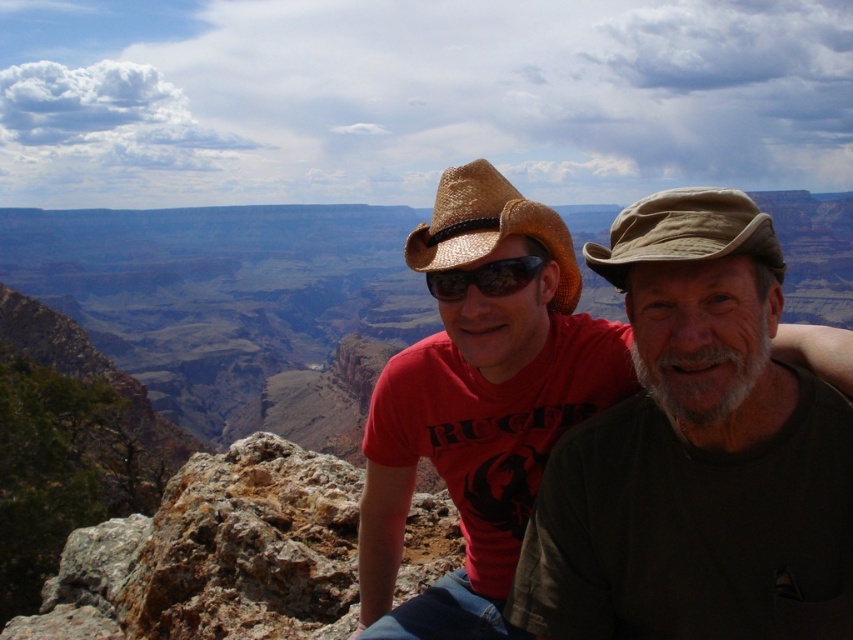
Question: Which point is farther from the camera taking this photo?

Choices:
 (A) (695, 616)
 (B) (711, 218)
 (C) (558, 289)
 (D) (527, 282)

Answer: (C)

Question: From the image, what is the correct spatial relationship of tan fabric cowboy hat at upper right in relation to matte black goggles at center?

Choices:
 (A) above
 (B) below

Answer: (A)

Question: Among these objects, which one is nearest to the camera?

Choices:
 (A) tan fabric cowboy hat at upper right
 (B) strawhat at center

Answer: (A)

Question: Based on their relative distances, which object is farther from the matte black goggles at center?

Choices:
 (A) strawhat at center
 (B) dark green fabric shirt at center
 (C) tan fabric cowboy hat at upper right

Answer: (C)

Question: Can you confirm if tan fabric cowboy hat at upper right is smaller than strawhat at center?

Choices:
 (A) yes
 (B) no

Answer: (B)

Question: Can you confirm if tan fabric cowboy hat at upper right is smaller than matte black goggles at center?

Choices:
 (A) no
 (B) yes

Answer: (A)